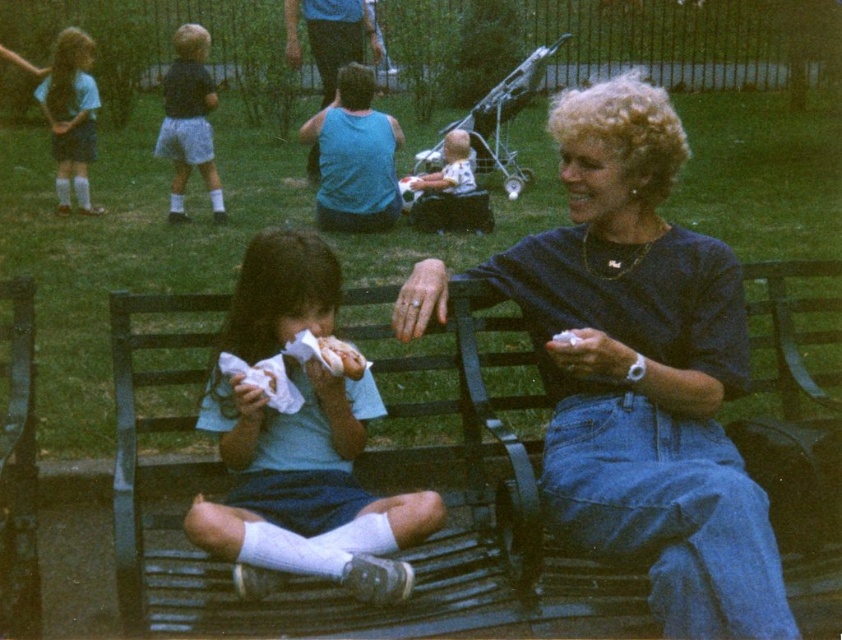
You are standing at the position of the adult on the bench. You need to throw a ball to a friend who is standing at point (210, 172). However, there is an obstacle at point (291, 417). Will the ball pass in front of the obstacle or behind it?

The ball will pass in front of the obstacle because point (291, 417) is in front of point (210, 172).

You are trying to decide which item of clothing to take with you from the scene. The white cotton shirt at center and the matte blue shorts at upper left are both options. Based on their sizes, which one might be more practical to carry?

The white cotton shirt at center has a lesser width compared to matte blue shorts at upper left, so it might be more practical to carry the white cotton shirt at center because it is smaller in size.